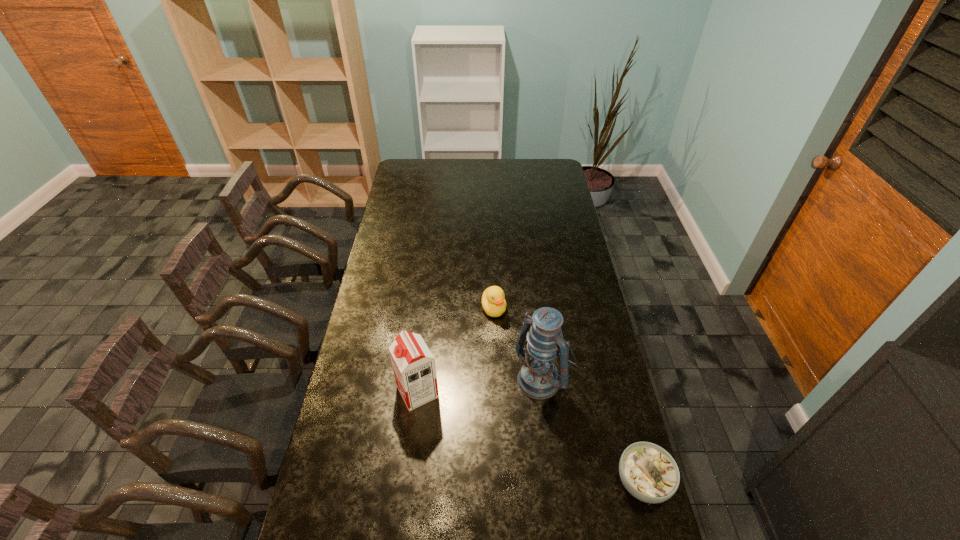
Where is `vacant spot on the desktop that is between the soya milk and the rightmost object and is positioned on the front-facing side of the tallest object`? vacant spot on the desktop that is between the soya milk and the rightmost object and is positioned on the front-facing side of the tallest object is located at coordinates (494, 422).

Where is `vacant spot on the desktop that is between the third shortest object and the soup bowl and is positioned at the beak of the duck`? The height and width of the screenshot is (540, 960). vacant spot on the desktop that is between the third shortest object and the soup bowl and is positioned at the beak of the duck is located at coordinates (529, 436).